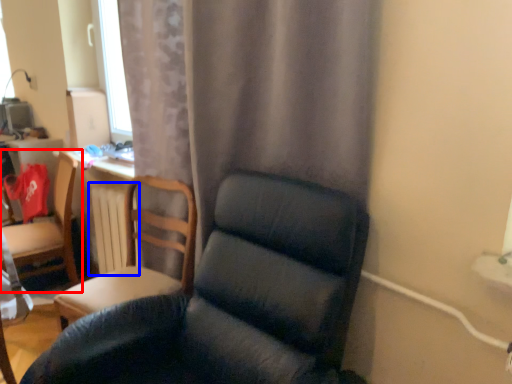
Question: Among these objects, which one is nearest to the camera, chair (highlighted by a red box) or radiator (highlighted by a blue box)?

Choices:
 (A) chair
 (B) radiator

Answer: (B)